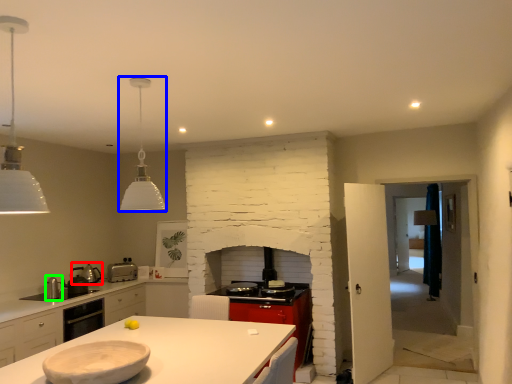
Question: Considering the real-world distances, which object is closest to appliance (highlighted by a red box)? light fixture (highlighted by a blue box) or appliance (highlighted by a green box).

Choices:
 (A) light fixture
 (B) appliance

Answer: (B)